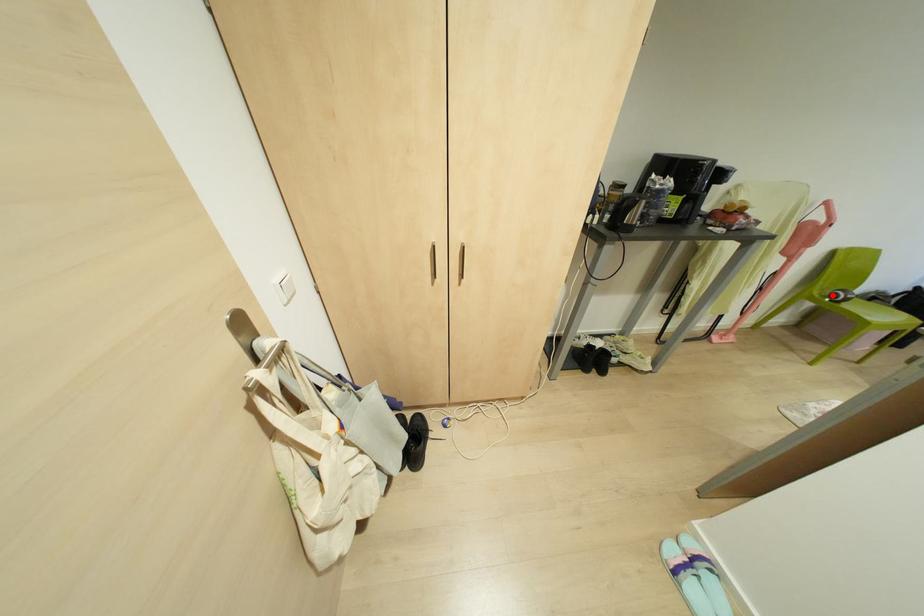
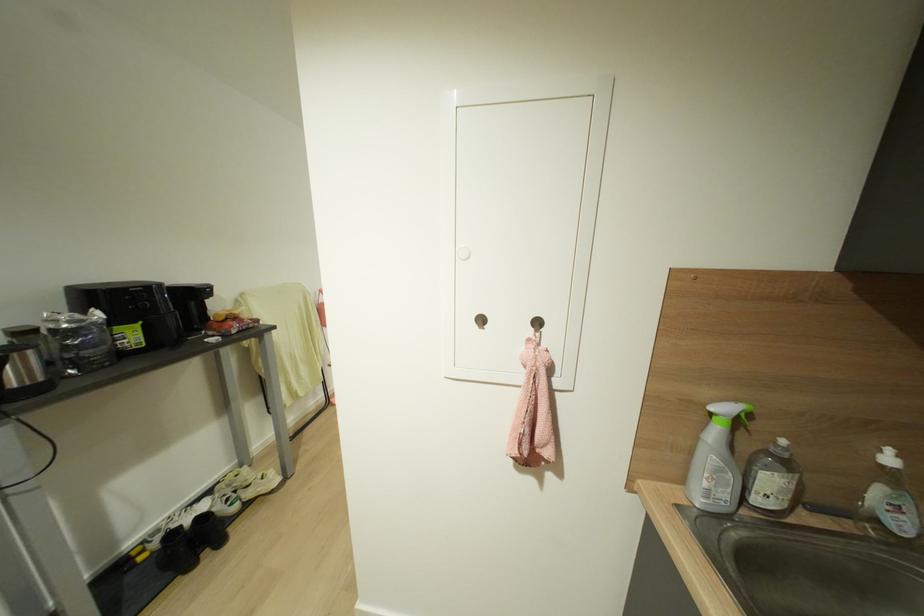
Question: I am providing you with two images of the same scene from different viewpoints. A red point is marked on the first image. At the location where the point appears in image 1, is it still visible in image 2?

Choices:
 (A) Yes
 (B) No

Answer: (B)